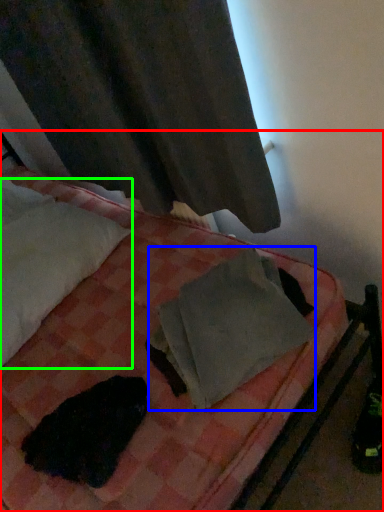
Question: Which is nearer to the bed (highlighted by a red box)? material (highlighted by a blue box) or pillow (highlighted by a green box).

Choices:
 (A) material
 (B) pillow

Answer: (A)